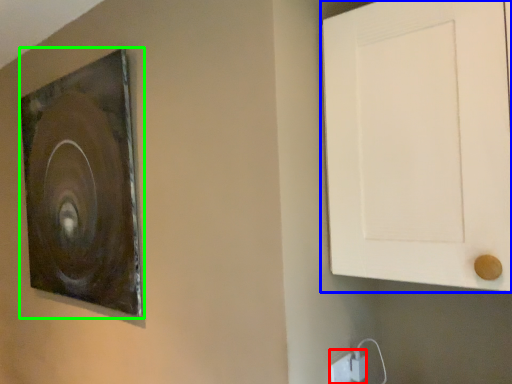
Question: Which object is positioned closest to electric outlet (highlighted by a red box)? Select from door (highlighted by a blue box) and picture frame (highlighted by a green box).

Choices:
 (A) door
 (B) picture frame

Answer: (A)